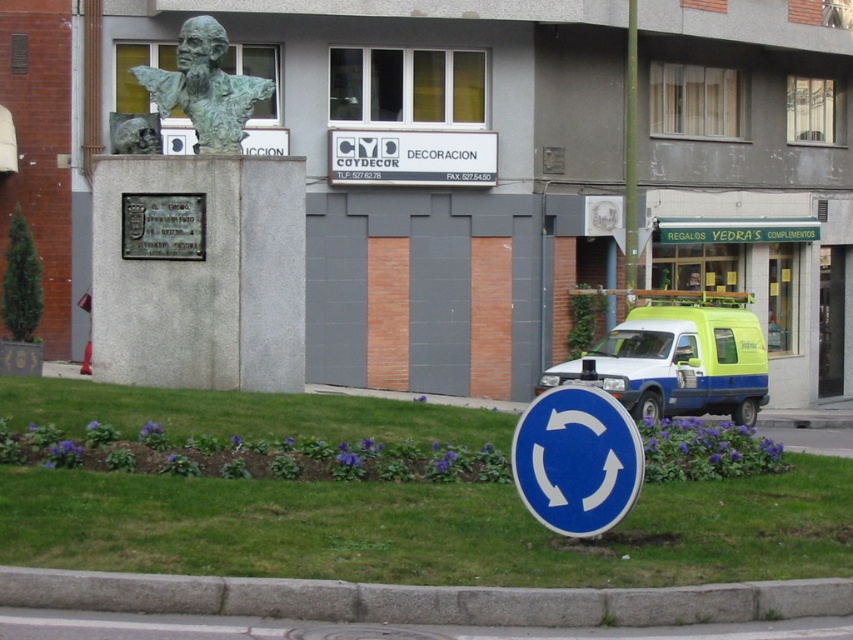
Question: Which object is positioned closest to the gray concrete curb at lower center?

Choices:
 (A) white plastic sign at center
 (B) metallic pole at right
 (C) white matte van at center

Answer: (C)

Question: Is gray concrete curb at lower center positioned in front of metallic pole at right?

Choices:
 (A) yes
 (B) no

Answer: (A)

Question: Which point is closer to the camera?

Choices:
 (A) (637, 342)
 (B) (384, 168)

Answer: (A)

Question: Which of the following is the closest to the observer?

Choices:
 (A) gray concrete curb at lower center
 (B) metallic pole at right
 (C) white matte van at center

Answer: (A)

Question: Is white plastic sign at center bigger than metallic pole at right?

Choices:
 (A) yes
 (B) no

Answer: (A)

Question: Observing the image, what is the correct spatial positioning of blue metallic traffic sign at center in reference to bronze statue at upper center?

Choices:
 (A) below
 (B) above

Answer: (A)